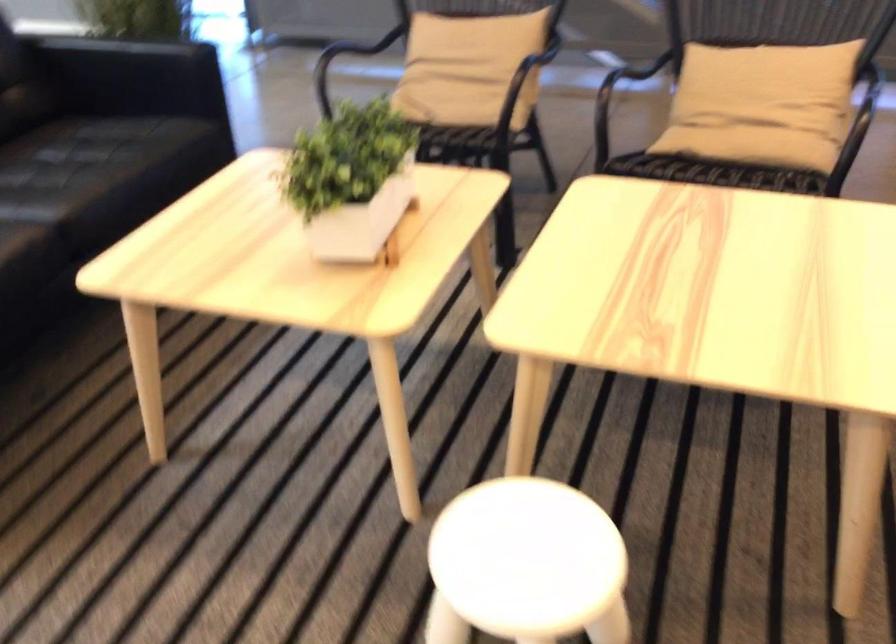
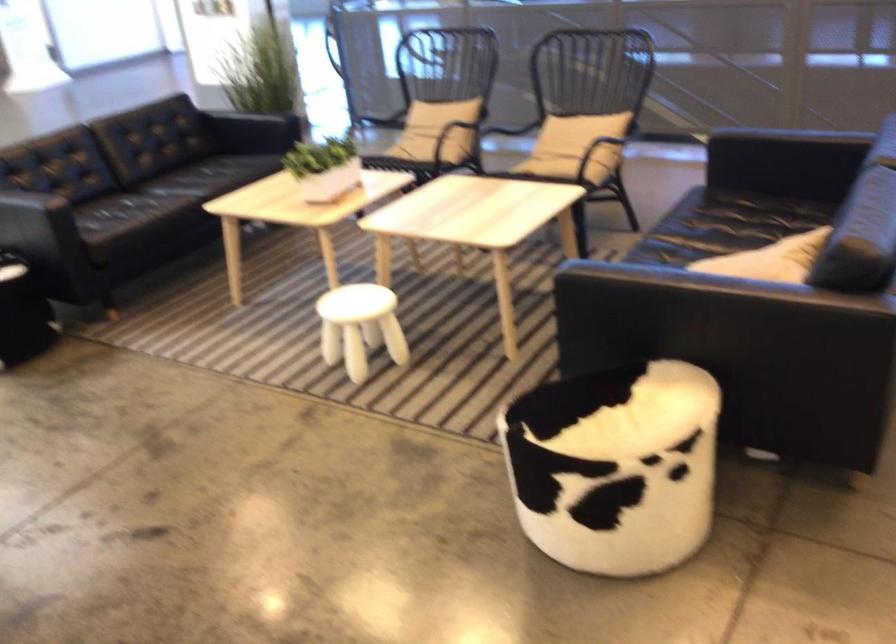
Find the pixel in the second image that matches (521,80) in the first image.

(440, 128)